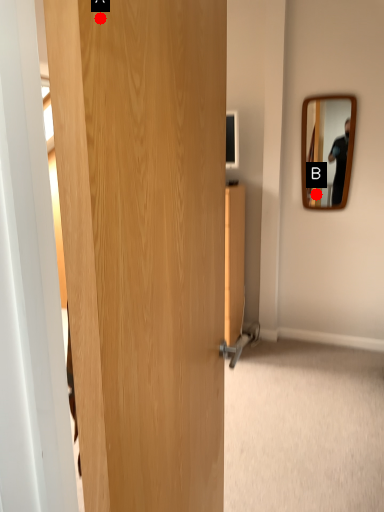
Question: Two points are circled on the image, labeled by A and B beside each circle. Which point is farther from the camera taking this photo?

Choices:
 (A) A is further
 (B) B is further

Answer: (B)